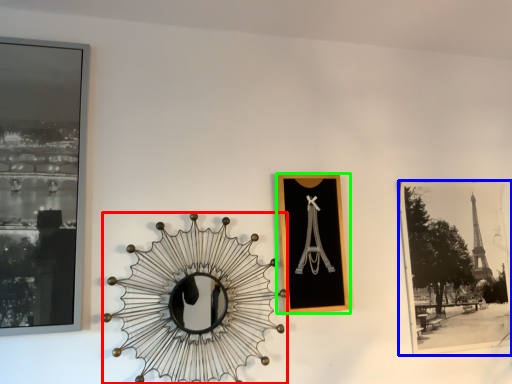
Question: Considering the real-world distances, which object is closest to design (highlighted by a red box)? picture frame (highlighted by a blue box) or picture frame (highlighted by a green box).

Choices:
 (A) picture frame
 (B) picture frame

Answer: (B)